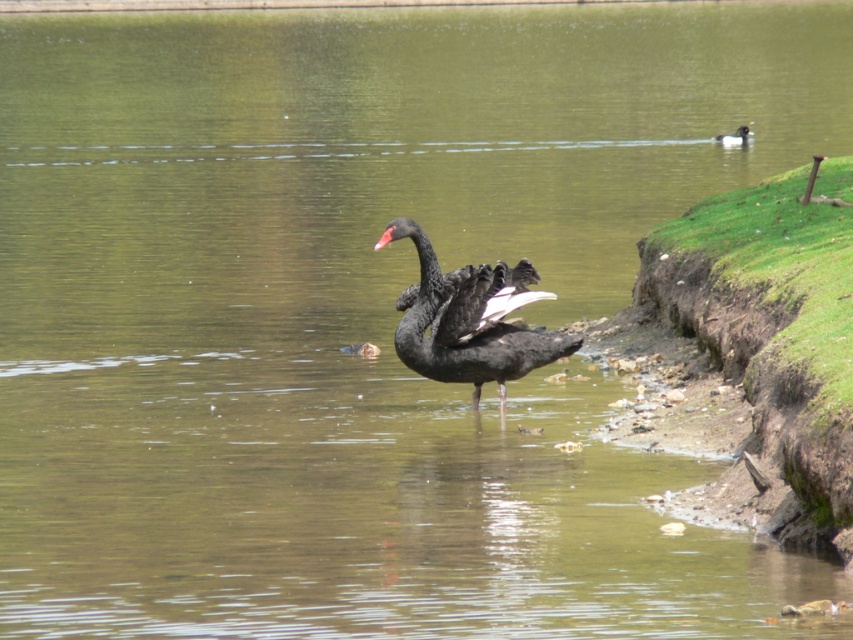
Between point (496, 288) and point (376, 244), which one is positioned behind?

The point (496, 288) is more distant.

Is matte black swan at center shorter than black matte beak at center?

In fact, matte black swan at center may be taller than black matte beak at center.

Identify the location of matte black swan at center. The height and width of the screenshot is (640, 853). (473, 321).